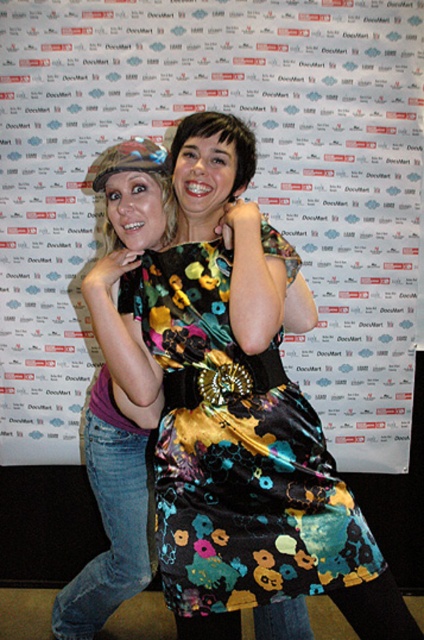
You are a GUI agent. You are given a task and a screenshot of the screen. Output one action in this format:
    pyautogui.click(x=<x>, y=<y>)
    Task: Click on the floral satin dress at center
    
    Given the screenshot: What is the action you would take?
    pyautogui.click(x=237, y=452)

Is floral satin dress at center to the right of multicolored floral dress at center from the viewer's perspective?

Yes, floral satin dress at center is to the right of multicolored floral dress at center.

I want to click on floral satin dress at center, so click(x=237, y=452).

Between floral fabric dress at center and denim jeans at left, which one is positioned higher?

floral fabric dress at center is higher up.

You are a GUI agent. You are given a task and a screenshot of the screen. Output one action in this format:
    pyautogui.click(x=<x>, y=<y>)
    Task: Click on the floral fabric dress at center
    Image resolution: width=424 pixels, height=640 pixels.
    Given the screenshot: What is the action you would take?
    pyautogui.click(x=247, y=193)

Where is `floral fabric dress at center`? The width and height of the screenshot is (424, 640). floral fabric dress at center is located at coordinates (247, 193).

Between floral fabric dress at center and multicolored floral dress at center, which one has more height?

floral fabric dress at center is taller.

What are the coordinates of `floral fabric dress at center` in the screenshot? It's located at (247, 193).

Locate an element on the screen. The height and width of the screenshot is (640, 424). floral fabric dress at center is located at coordinates (247, 193).